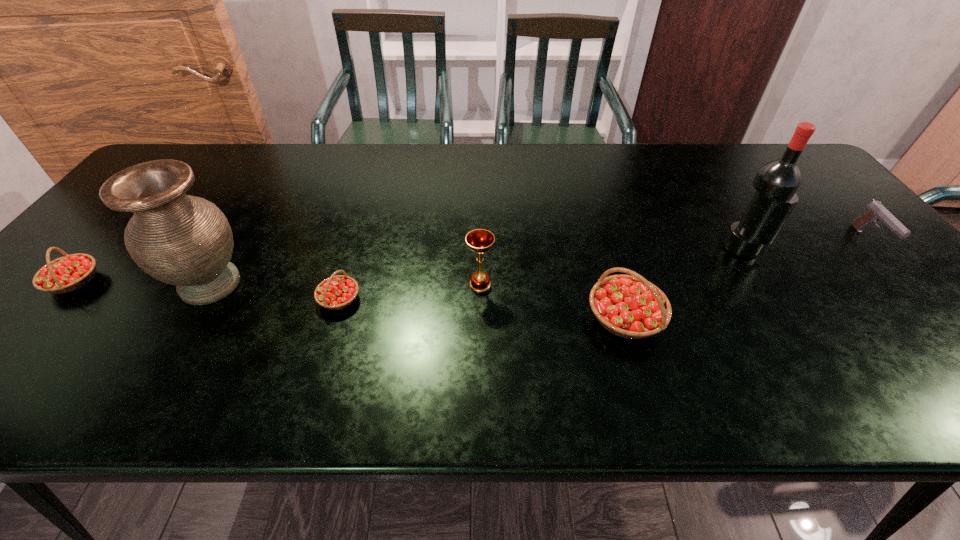
Locate an element on the screen. the second tallest object is located at coordinates (182, 240).

The image size is (960, 540). I want to click on free location located on the back of the leftmost strawberry, so click(x=161, y=183).

Locate an element on the screen. This screenshot has width=960, height=540. blank space located on the right of the shortest object is located at coordinates (391, 299).

Where is `blank space located on the left of the fifth object from left to right`? This screenshot has height=540, width=960. blank space located on the left of the fifth object from left to right is located at coordinates (432, 318).

Identify the location of vacant position located 0.160m on the back of the sixth object from left to right. The width and height of the screenshot is (960, 540). (715, 200).

Where is `vacant space located 0.130m on the back of the fourth object from left to right`? The height and width of the screenshot is (540, 960). vacant space located 0.130m on the back of the fourth object from left to right is located at coordinates (480, 240).

The image size is (960, 540). What are the coordinates of `vacant point located 0.120m at the barrel of the pistol` in the screenshot? It's located at (919, 295).

Find the location of a particular element. The height and width of the screenshot is (540, 960). vacant space located 0.200m on the left of the second object from left to right is located at coordinates (85, 285).

Find the location of `object positioned at the near edge`. object positioned at the near edge is located at coordinates (628, 306).

The image size is (960, 540). I want to click on object located in the left edge section of the desktop, so click(x=66, y=274).